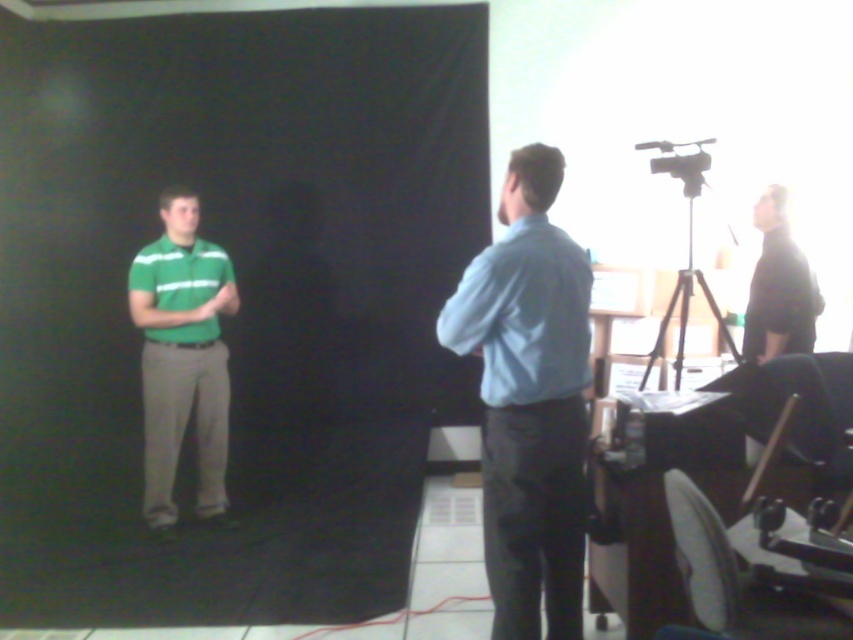
From the picture: Does light blue cotton polo shirt at center appear on the left side of black matte shirt at right?

Correct, you'll find light blue cotton polo shirt at center to the left of black matte shirt at right.

Can you confirm if light blue cotton polo shirt at center is taller than black matte shirt at right?

Incorrect, light blue cotton polo shirt at center's height is not larger of black matte shirt at right's.

Which is behind, point (554, 392) or point (793, 314)?

Positioned behind is point (793, 314).

I want to click on light blue cotton polo shirt at center, so click(x=523, y=314).

Between point (502, 612) and point (149, 465), which one is positioned in front?

Point (502, 612)

This screenshot has width=853, height=640. Identify the location of light blue shirt at center. (529, 401).

Where is `light blue shirt at center`? This screenshot has height=640, width=853. light blue shirt at center is located at coordinates (529, 401).

Does green matte shirt at left appear under black matte shirt at right?

Indeed, green matte shirt at left is positioned under black matte shirt at right.

Is point (175, 252) farther from camera compared to point (770, 193)?

That is True.

Identify the location of green matte shirt at left. (183, 356).